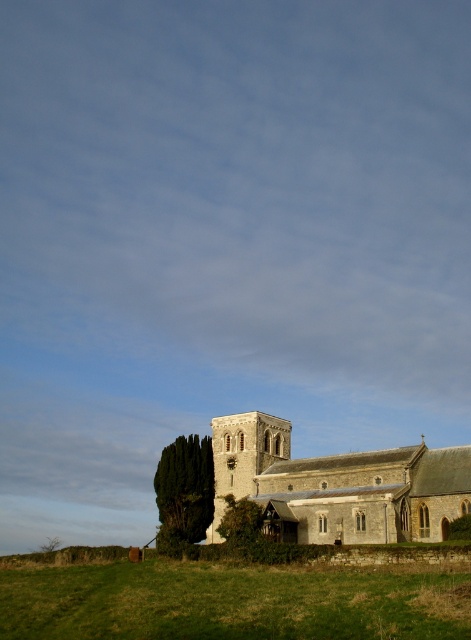
Does green grassy field at lower center have a smaller size compared to green textured tree at lower left?

No.

Can you confirm if green grassy field at lower center is thinner than green textured tree at lower left?

Incorrect, green grassy field at lower center's width is not less than green textured tree at lower left's.

What do you see at coordinates (233, 602) in the screenshot? The image size is (471, 640). I see `green grassy field at lower center` at bounding box center [233, 602].

This screenshot has width=471, height=640. Find the location of `green grassy field at lower center`. green grassy field at lower center is located at coordinates (233, 602).

Is green grassy field at lower center smaller than stone church at center?

Correct, green grassy field at lower center occupies less space than stone church at center.

What do you see at coordinates (233, 602) in the screenshot?
I see `green grassy field at lower center` at bounding box center [233, 602].

I want to click on green grassy field at lower center, so click(x=233, y=602).

Does stone church at center appear on the left side of green textured tree at lower left?

In fact, stone church at center is to the right of green textured tree at lower left.

Does stone church at center have a greater height compared to green textured tree at lower left?

Correct, stone church at center is much taller as green textured tree at lower left.

I want to click on stone church at center, so 336,484.